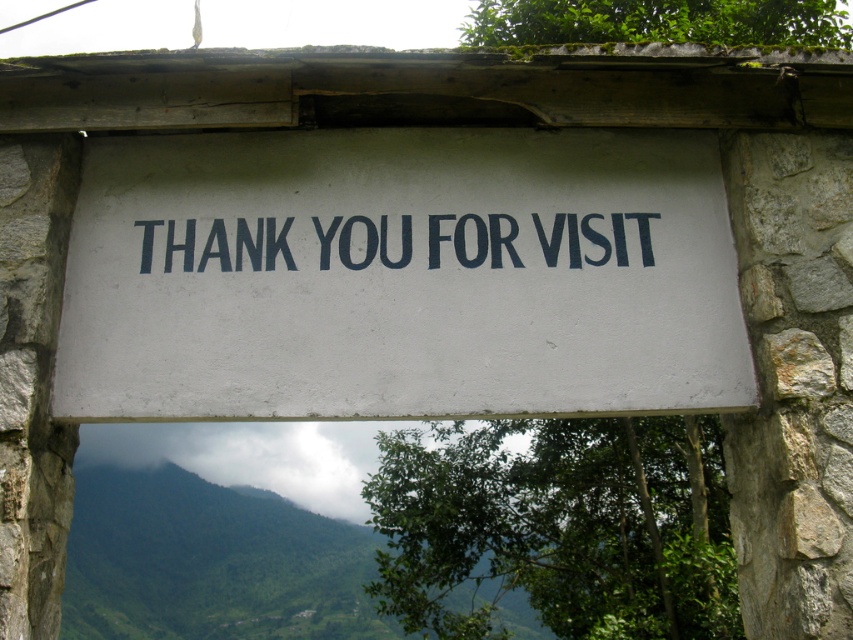
Question: Is white matte sign at center positioned behind blackmaterial/texture sign at center?

Choices:
 (A) yes
 (B) no

Answer: (B)

Question: Is white matte sign at center wider than blackmaterial/texture sign at center?

Choices:
 (A) yes
 (B) no

Answer: (A)

Question: Which object appears farthest from the camera in this image?

Choices:
 (A) white matte sign at center
 (B) blackmaterial/texture sign at center

Answer: (B)

Question: From the image, what is the correct spatial relationship of white matte sign at center in relation to blackmaterial/texture sign at center?

Choices:
 (A) above
 (B) below

Answer: (B)